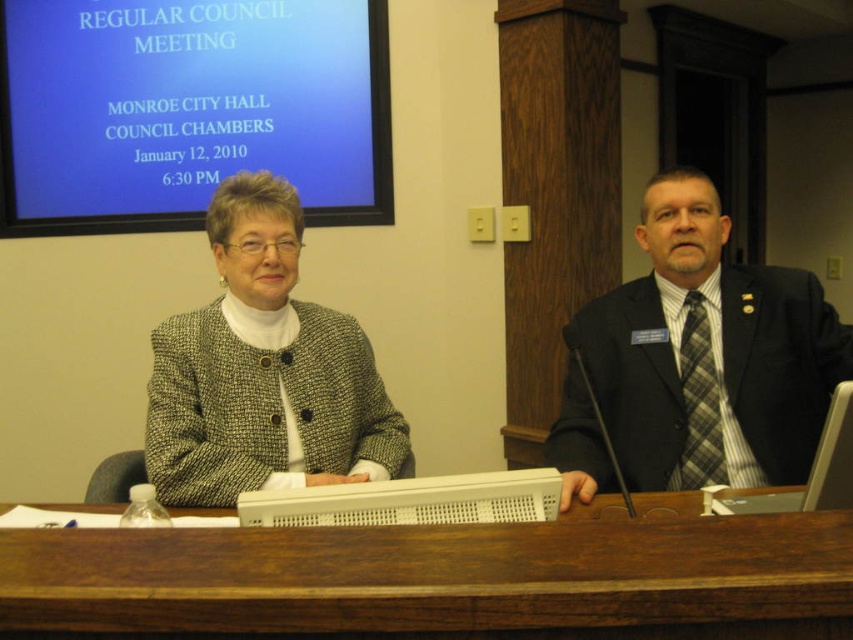
Question: Does brown wood table at center appear under blue glossy projector screen at upper center?

Choices:
 (A) no
 (B) yes

Answer: (B)

Question: Can you confirm if brown wood table at center is wider than gray tweed jacket at center?

Choices:
 (A) no
 (B) yes

Answer: (B)

Question: Estimate the real-world distances between objects in this image. Which object is farther from the white plastic laptop at center?

Choices:
 (A) brown wood table at center
 (B) dark blue suit at right
 (C) blue glossy projector screen at upper center
 (D) gray tweed jacket at center

Answer: (C)

Question: Which point is closer to the camera?

Choices:
 (A) gray tweed jacket at center
 (B) brown wood table at center

Answer: (B)

Question: Which of the following is the closest to the observer?

Choices:
 (A) blue glossy projector screen at upper center
 (B) white plastic laptop at center
 (C) gray tweed jacket at center

Answer: (B)

Question: Does brown wood table at center come in front of plastic keyboard at center?

Choices:
 (A) no
 (B) yes

Answer: (B)